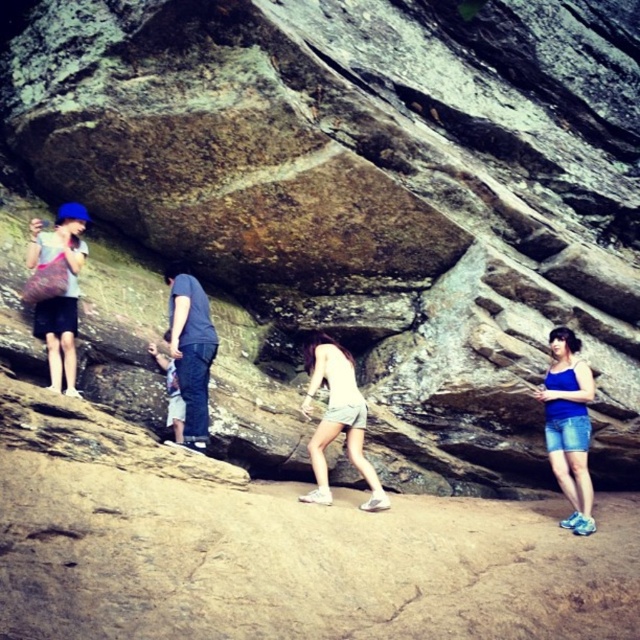
In order to click on matte blue hat at left in this screenshot , I will do `click(58, 289)`.

Is matte blue hat at left above dark blue jeans at center?

Indeed, matte blue hat at left is positioned over dark blue jeans at center.

The image size is (640, 640). What do you see at coordinates (58, 289) in the screenshot?
I see `matte blue hat at left` at bounding box center [58, 289].

Locate an element on the screen. matte blue hat at left is located at coordinates (58, 289).

Is blue denim shorts at lower right positioned at the back of dark blue jeans at center?

That is True.

Is blue denim shorts at lower right bigger than dark blue jeans at center?

Yes, blue denim shorts at lower right is bigger than dark blue jeans at center.

Is point (577, 449) positioned behind point (180, 352)?

Yes, point (577, 449) is behind point (180, 352).

You are a GUI agent. You are given a task and a screenshot of the screen. Output one action in this format:
    pyautogui.click(x=<x>, y=<y>)
    Task: Click on the blue denim shorts at lower right
    The image size is (640, 640).
    Given the screenshot: What is the action you would take?
    pyautogui.click(x=568, y=426)

Who is positioned more to the left, matte blue hat at left or blue denim shorts at lower right?

matte blue hat at left

Is point (45, 272) closer to camera compared to point (536, 392)?

Yes, point (45, 272) is closer to viewer.

Does point (58, 349) lie behind point (573, 531)?

No, (58, 349) is closer to viewer.

Locate an element on the screen. matte blue hat at left is located at coordinates (58, 289).